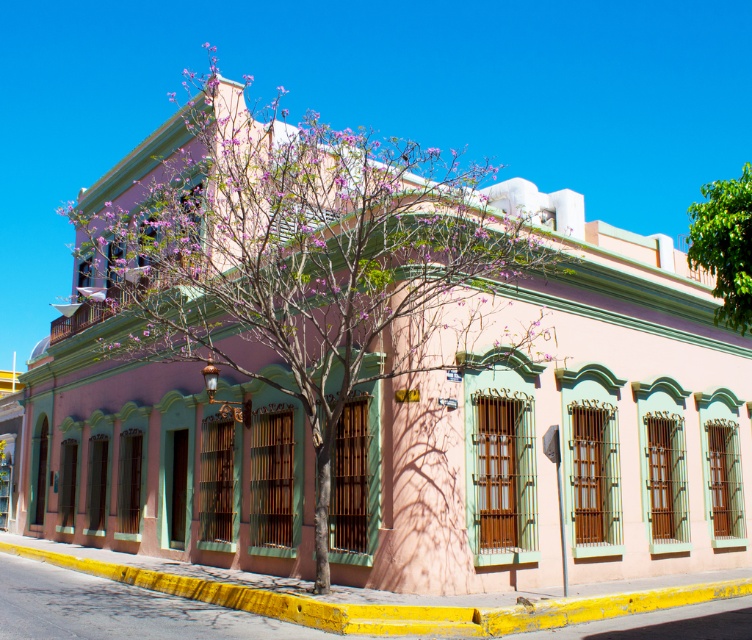
Is pink textured tree at center in front of green leafy tree at upper right?

No.

Can you confirm if pink textured tree at center is positioned below green leafy tree at upper right?

Incorrect, pink textured tree at center is not positioned below green leafy tree at upper right.

You are a GUI agent. You are given a task and a screenshot of the screen. Output one action in this format:
    pyautogui.click(x=<x>, y=<y>)
    Task: Click on the pink textured tree at center
    The width and height of the screenshot is (752, 640).
    Given the screenshot: What is the action you would take?
    pyautogui.click(x=308, y=266)

Locate an element on the screen. This screenshot has width=752, height=640. pink textured tree at center is located at coordinates point(308,266).